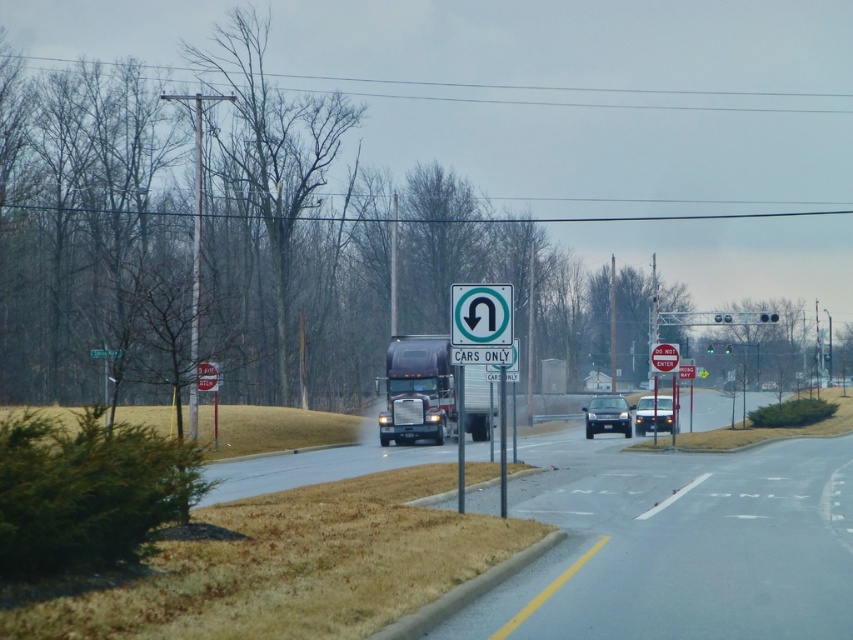
Question: Is metallic silver trailer truck at center below red plastic sign at center?

Choices:
 (A) no
 (B) yes

Answer: (B)

Question: Where is green plastic sign at center located in relation to shiny black sedan at center in the image?

Choices:
 (A) below
 (B) above

Answer: (B)

Question: Which object is farther from the camera taking this photo?

Choices:
 (A) red plastic sign at center
 (B) metallic silver trailer truck at center
 (C) green plastic sign at center
 (D) matte black sedan at center

Answer: (D)

Question: Where is metallic silver trailer truck at center located in relation to green plastic sign at center in the image?

Choices:
 (A) right
 (B) left

Answer: (B)

Question: Estimate the real-world distances between objects in this image. Which object is farther from the red plastic sign at center?

Choices:
 (A) green plastic sign at center
 (B) matte black sedan at center

Answer: (A)

Question: Which object is positioned closest to the metallic silver trailer truck at center?

Choices:
 (A) matte black sedan at center
 (B) shiny black sedan at center
 (C) green plastic sign at center
 (D) red plastic sign at center

Answer: (A)